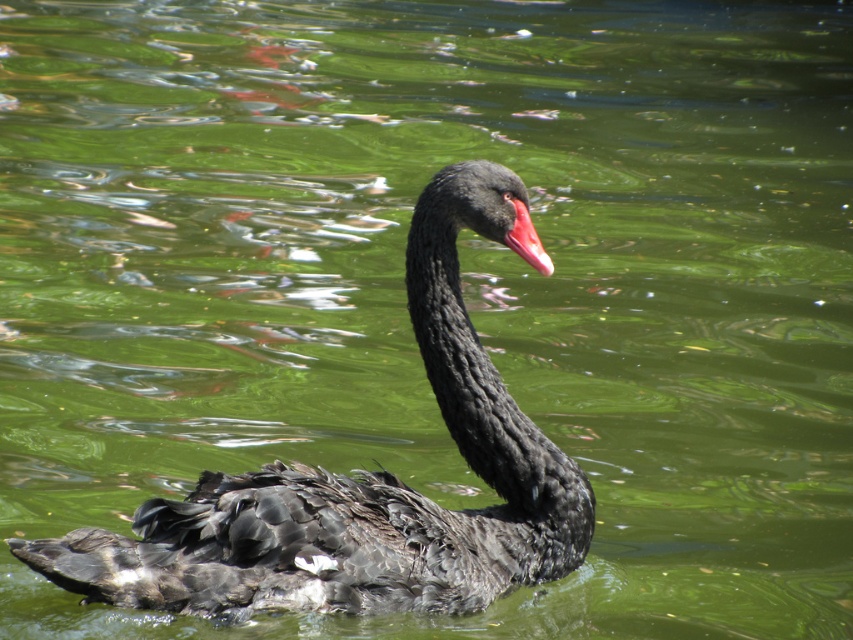
You are an ornithologist observing a black swan in its natural habitat. You notice the shiny black swan at center and the matte pink beak at center. Which object occupies more space in the image?

The shiny black swan at center is larger in size than the matte pink beak at center, so the shiny black swan at center occupies more space in the image.

You are an ornithologist observing the shiny black swan at center and the matte pink beak at center. Which object is taller?

The shiny black swan at center is taller than the matte pink beak at center.